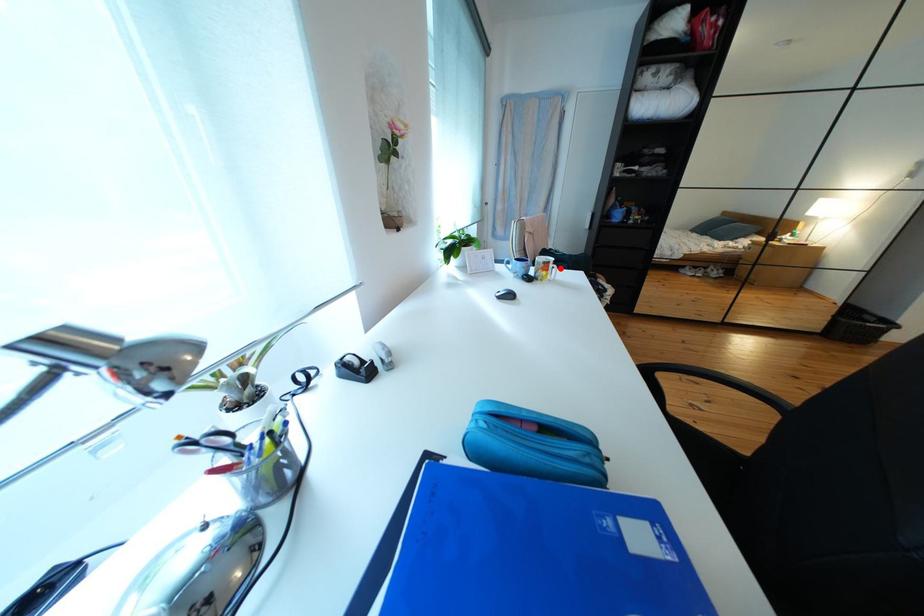
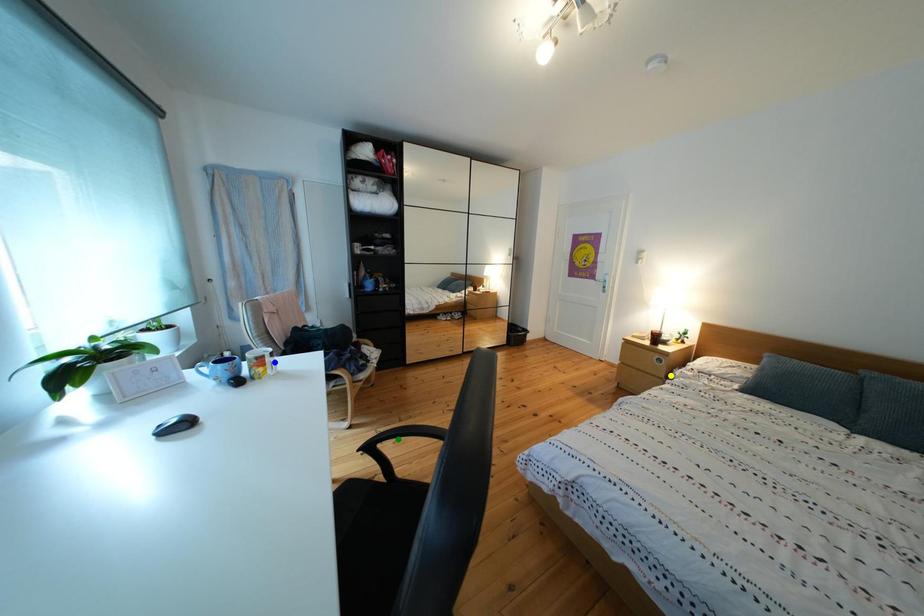
Question: I am providing you with two images of the same scene from different viewpoints. A red point is marked on the first image. You are given multiple points on the second image. Can you choose the point in image 2 that corresponds to the point in image 1?

Choices:
 (A) yellow point
 (B) blue point
 (C) green point

Answer: (B)